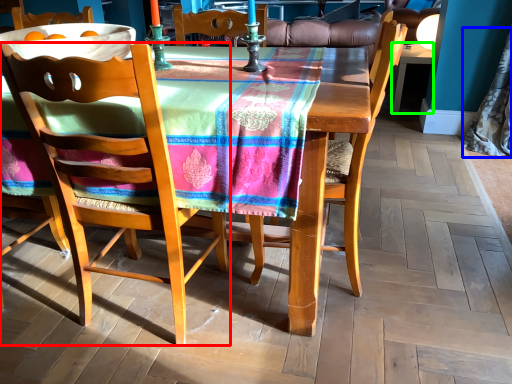
Question: Based on their relative distances, which object is nearer to chair (highlighted by a red box)? Choose from curtain (highlighted by a blue box) and desk (highlighted by a green box).

Choices:
 (A) curtain
 (B) desk

Answer: (A)